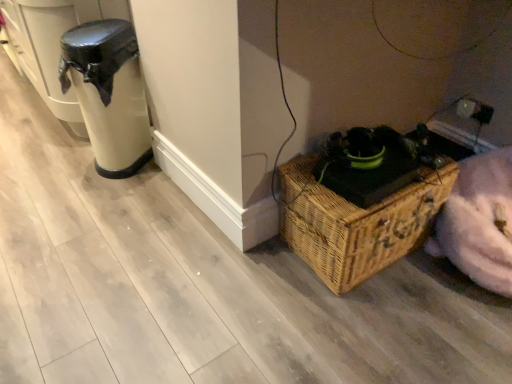
Question: Considering the relative sizes of matte black trash can at left and woven brown picnic basket at lower right in the image provided, is matte black trash can at left thinner than woven brown picnic basket at lower right?

Choices:
 (A) yes
 (B) no

Answer: (A)

Question: Considering the relative sizes of matte black trash can at left and woven brown picnic basket at lower right in the image provided, is matte black trash can at left smaller than woven brown picnic basket at lower right?

Choices:
 (A) no
 (B) yes

Answer: (B)

Question: Is matte black trash can at left positioned in front of woven brown picnic basket at lower right?

Choices:
 (A) no
 (B) yes

Answer: (A)

Question: From a real-world perspective, is matte black trash can at left positioned over woven brown picnic basket at lower right based on gravity?

Choices:
 (A) no
 (B) yes

Answer: (B)

Question: Is matte black trash can at left behind woven brown picnic basket at lower right?

Choices:
 (A) yes
 (B) no

Answer: (A)

Question: Is matte black trash can at left facing away from woven brown picnic basket at lower right?

Choices:
 (A) no
 (B) yes

Answer: (A)

Question: Is woven brown picnic basket at lower right at the right side of matte black trash can at left?

Choices:
 (A) no
 (B) yes

Answer: (B)

Question: Could matte black trash can at left be considered to be inside woven brown picnic basket at lower right?

Choices:
 (A) yes
 (B) no

Answer: (B)

Question: Is woven brown picnic basket at lower right oriented towards matte black trash can at left?

Choices:
 (A) no
 (B) yes

Answer: (A)

Question: Can you confirm if woven brown picnic basket at lower right is thinner than matte black trash can at left?

Choices:
 (A) yes
 (B) no

Answer: (B)

Question: Is woven brown picnic basket at lower right far from matte black trash can at left?

Choices:
 (A) yes
 (B) no

Answer: (A)

Question: Considering the relative sizes of woven brown picnic basket at lower right and matte black trash can at left in the image provided, is woven brown picnic basket at lower right shorter than matte black trash can at left?

Choices:
 (A) yes
 (B) no

Answer: (A)

Question: In terms of width, does woven brown picnic basket at lower right look wider or thinner when compared to matte black trash can at left?

Choices:
 (A) thin
 (B) wide

Answer: (B)